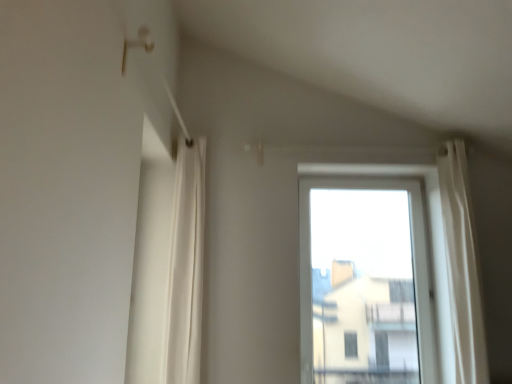
Question: Does transparent glass window at center have a greater width compared to white fabric curtain at left?

Choices:
 (A) no
 (B) yes

Answer: (A)

Question: From a real-world perspective, is transparent glass window at center physically below white fabric curtain at left?

Choices:
 (A) yes
 (B) no

Answer: (A)

Question: Considering the relative sizes of transparent glass window at center and white fabric curtain at left in the image provided, is transparent glass window at center bigger than white fabric curtain at left?

Choices:
 (A) yes
 (B) no

Answer: (A)

Question: Considering the relative positions of transparent glass window at center and white fabric curtain at left in the image provided, is transparent glass window at center to the left of white fabric curtain at left from the viewer's perspective?

Choices:
 (A) yes
 (B) no

Answer: (B)

Question: From the image's perspective, is transparent glass window at center over white fabric curtain at left?

Choices:
 (A) yes
 (B) no

Answer: (B)

Question: Is transparent glass window at center further to camera compared to white fabric curtain at left?

Choices:
 (A) no
 (B) yes

Answer: (B)

Question: From the image's perspective, is white fabric curtain at left beneath transparent glass window at center?

Choices:
 (A) yes
 (B) no

Answer: (B)

Question: Does white fabric curtain at left have a smaller size compared to transparent glass window at center?

Choices:
 (A) no
 (B) yes

Answer: (B)

Question: Considering the relative positions of white fabric curtain at left and transparent glass window at center in the image provided, is white fabric curtain at left to the right of transparent glass window at center from the viewer's perspective?

Choices:
 (A) yes
 (B) no

Answer: (B)

Question: Can you confirm if white fabric curtain at left is shorter than transparent glass window at center?

Choices:
 (A) yes
 (B) no

Answer: (B)

Question: From a real-world perspective, is white fabric curtain at left positioned under transparent glass window at center based on gravity?

Choices:
 (A) yes
 (B) no

Answer: (B)

Question: Can you see white fabric curtain at left touching transparent glass window at center?

Choices:
 (A) no
 (B) yes

Answer: (A)

Question: Do you think white fabric curtain at left is within transparent glass window at center, or outside of it?

Choices:
 (A) outside
 (B) inside

Answer: (A)